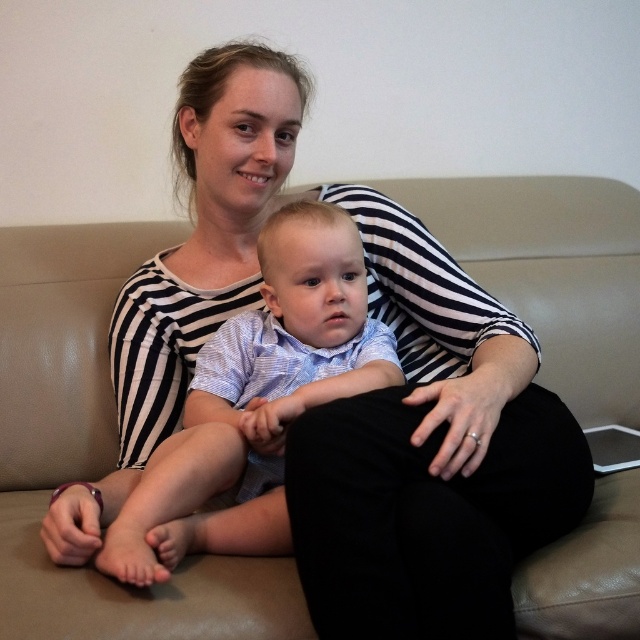
Question: Does beige leather couch at center have a larger size compared to light blue striped shirt at center?

Choices:
 (A) no
 (B) yes

Answer: (B)

Question: Does beige leather couch at center have a smaller size compared to light blue striped shirt at center?

Choices:
 (A) yes
 (B) no

Answer: (B)

Question: From the image, what is the correct spatial relationship of beige leather couch at center in relation to light blue striped shirt at center?

Choices:
 (A) below
 (B) above

Answer: (B)

Question: Which point is closer to the camera?

Choices:
 (A) (324, 305)
 (B) (467, 196)

Answer: (A)

Question: Which of the following is the farthest from the observer?

Choices:
 (A) (154, 556)
 (B) (544, 184)

Answer: (B)